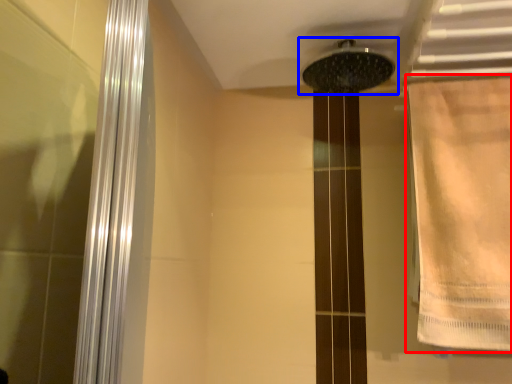
Question: Which point is further to the camera, shower curtain (highlighted by a red box) or shower (highlighted by a blue box)?

Choices:
 (A) shower curtain
 (B) shower

Answer: (B)